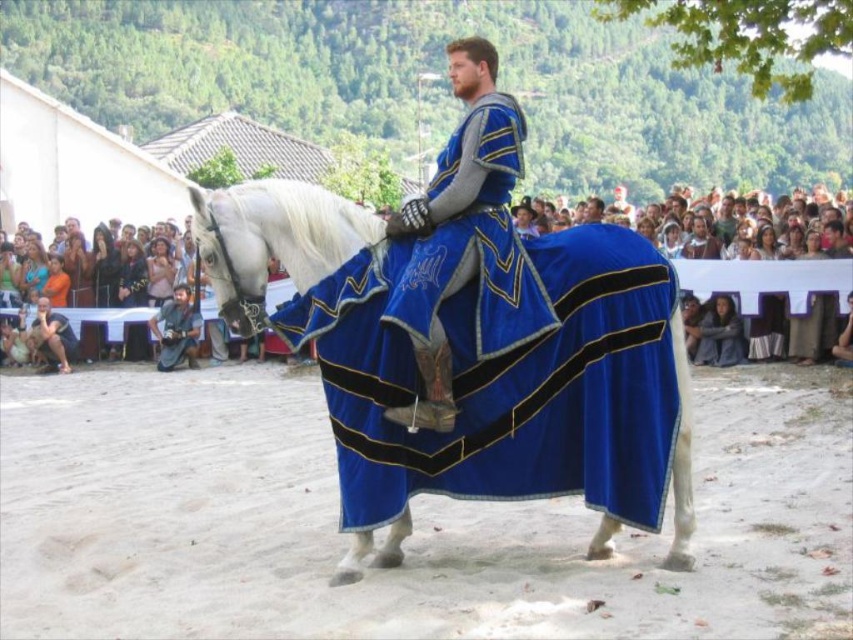
Question: Does smooth skin people at center come in front of blue denim jeans at lower left?

Choices:
 (A) no
 (B) yes

Answer: (B)

Question: Among these objects, which one is farthest from the camera?

Choices:
 (A) blue denim jeans at lower left
 (B) white glossy horse at center
 (C) smooth skin people at center

Answer: (A)

Question: Which point is closer to the camera?

Choices:
 (A) (761, 266)
 (B) (440, 413)
 (C) (683, 502)

Answer: (B)

Question: Which is nearer to the white glossy horse at center?

Choices:
 (A) smooth skin people at center
 (B) blue denim jeans at lower left

Answer: (A)

Question: Does blue velvet cape at center appear over white glossy horse at center?

Choices:
 (A) no
 (B) yes

Answer: (B)

Question: Can you confirm if blue velvet cape at center is wider than smooth skin people at center?

Choices:
 (A) yes
 (B) no

Answer: (B)